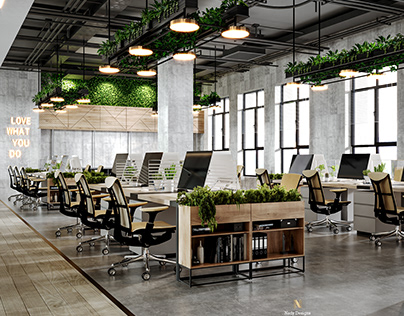
You are a GUI agent. You are given a task and a screenshot of the screen. Output one action in this format:
    pyautogui.click(x=<x>, y=<y>)
    Task: Click on the desks
    The height and width of the screenshot is (316, 404).
    Given the screenshot: What is the action you would take?
    pyautogui.click(x=160, y=197), pyautogui.click(x=127, y=189), pyautogui.click(x=99, y=184), pyautogui.click(x=72, y=180), pyautogui.click(x=43, y=175), pyautogui.click(x=345, y=185), pyautogui.click(x=277, y=181), pyautogui.click(x=399, y=188)